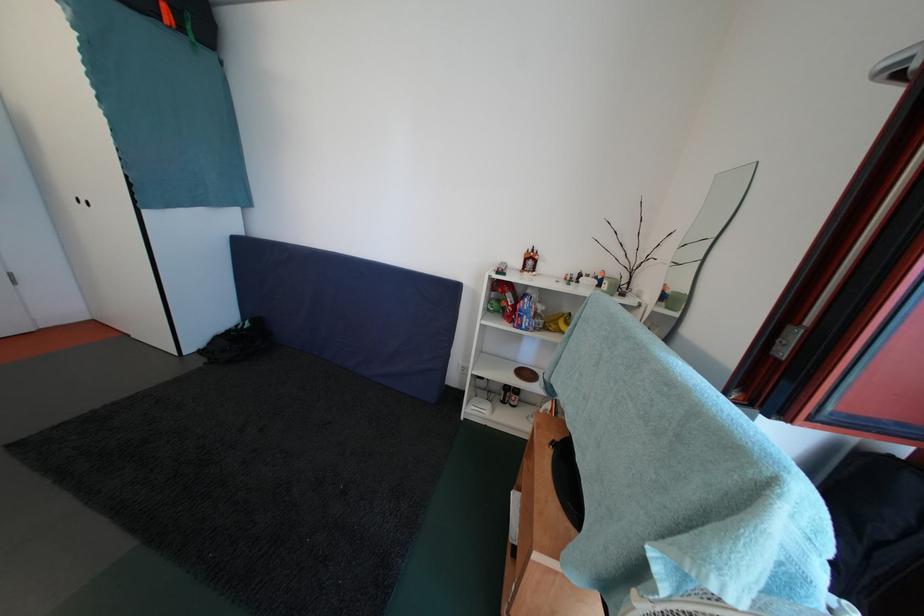
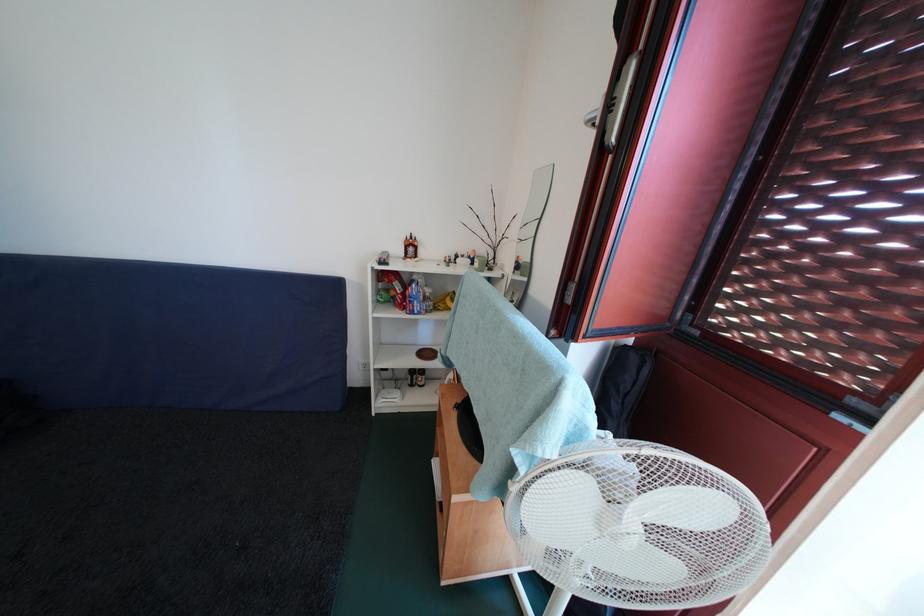
Locate, in the second image, the point that corresponds to the point at 532,379 in the first image.

(433, 359)